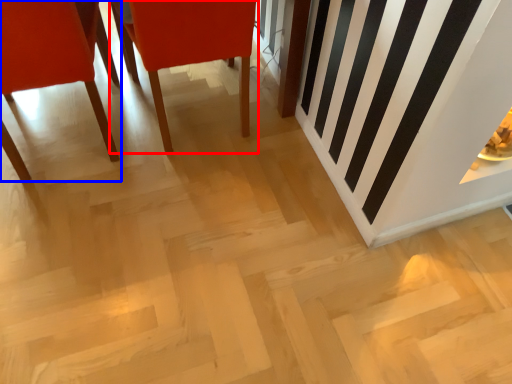
Question: Among these objects, which one is nearest to the camera, chair (highlighted by a red box) or chair (highlighted by a blue box)?

Choices:
 (A) chair
 (B) chair

Answer: (B)